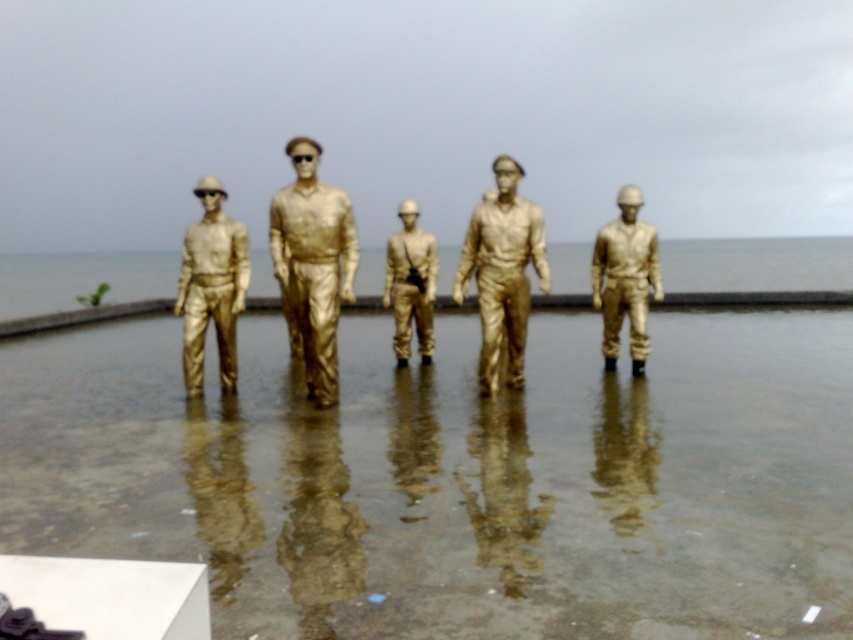
You are an art curator planning to display the shiny gold statue at center and the gold metallic statue at left in a new exhibition. Based on their sizes, which statue should be placed on a higher pedestal to ensure both appear balanced in the display?

The shiny gold statue at center should be placed on a lower pedestal because it is taller than the gold metallic statue at left, allowing both to appear balanced when viewed from the front.

From the picture: You are a tour guide explaining the arrangement of the statues to visitors. You mention the shiny gold statue at center and the gold metallic figure at center. Which one is located to the right?

The gold metallic figure at center is located to the right of the shiny gold statue at center.

You are a photographer standing at the position where the camera is located. You want to take a photo of the shiny gold statue at center. The statue is 6.93 meters away from you. Your camera has a focal length of 50mm. What is the approximate angle of view required to capture the entire statue in the frame?

The angle of view required to capture the entire shiny gold statue at center depends on the camera sensor size. Without knowing the sensor size, we cannot calculate the exact angle of view. However, using a 50mm lens on a full frame camera typically provides a 46 degree angle of view, which might be suitable depending on the statue size and distance.